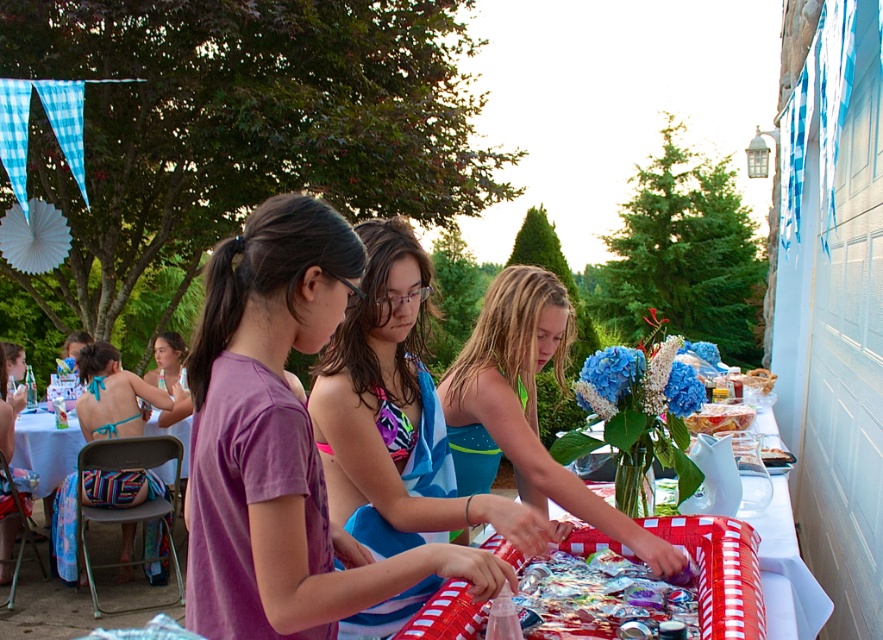
You are standing at the point with coordinates (782, 460) and want to walk to the point with coordinates (97, 500). Based on the scene description, will you be able to see the destination point from your current position?

Point (97, 500) is behind point (782, 460), so you won t be able to see it from your current position.

You are standing at the edge of the party scene and want to take a photo of both the point at coordinates (726, 426) and the point at coordinates (775, 449). Which point will appear closer to the camera in your photo?

Point (726, 426) is further to the camera than point (775, 449), so in the photo, point (726, 426) will appear closer to the camera than point (775, 449).

Please provide the coordinate of the shiny plastic tray at right in the image. The coordinate should be in the format of a point with two decimal places, like this example format point 0.5,0.5.

The shiny plastic tray at right is located at point (719,417).